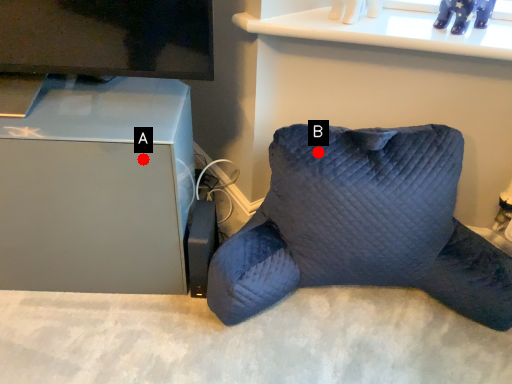
Question: Two points are circled on the image, labeled by A and B beside each circle. Which point appears closest to the camera in this image?

Choices:
 (A) A is closer
 (B) B is closer

Answer: (A)